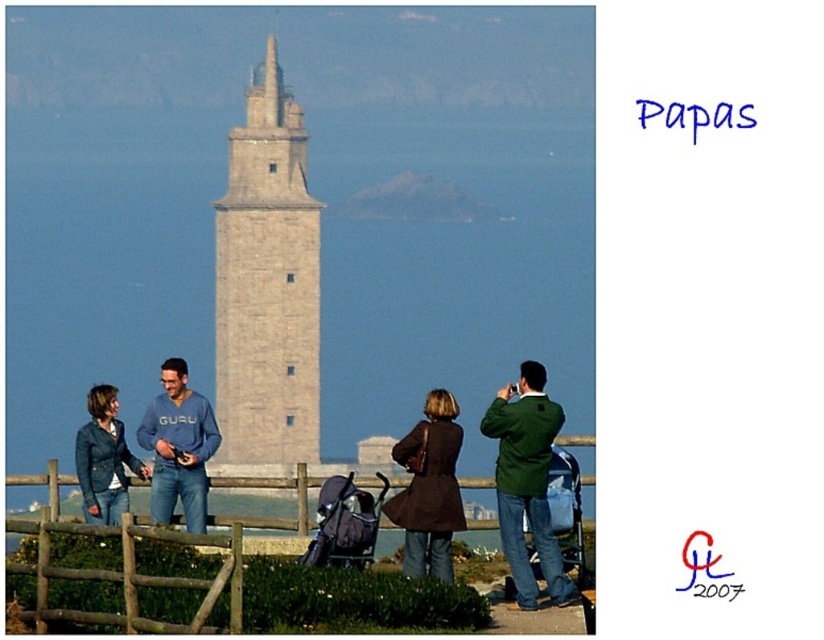
Which is below, stone tower at center or green matte jacket at center?

green matte jacket at center is below.

What do you see at coordinates (267, 284) in the screenshot? The width and height of the screenshot is (824, 640). I see `stone tower at center` at bounding box center [267, 284].

Is point (307, 248) farther from viewer compared to point (515, 529)?

Yes, point (307, 248) is farther from viewer.

Where is `stone tower at center`? stone tower at center is located at coordinates (267, 284).

Which of these two, brown leather coat at center or matte blue sweatshirt at center, stands taller?

brown leather coat at center is taller.

Is brown leather coat at center bigger than matte blue sweatshirt at center?

Correct, brown leather coat at center is larger in size than matte blue sweatshirt at center.

Which is in front, point (396, 496) or point (151, 480)?

Point (396, 496) is in front.

The height and width of the screenshot is (640, 824). I want to click on brown leather coat at center, so click(x=429, y=490).

Is point (204, 509) less distant than point (77, 460)?

That is True.

Locate an element on the screen. matte blue sweatshirt at center is located at coordinates (178, 445).

At what (x,y) coordinates should I click in order to perform the action: click on matte blue sweatshirt at center. Please return your answer as a coordinate pair (x, y). The height and width of the screenshot is (640, 824). Looking at the image, I should click on (178, 445).